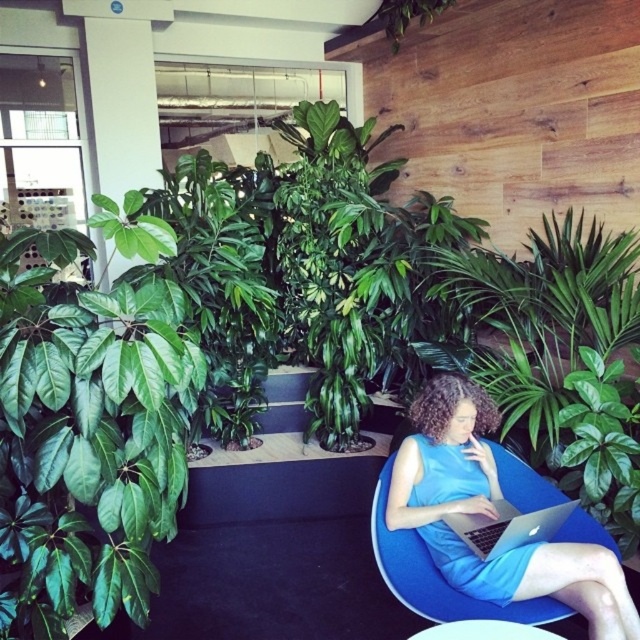
Question: Considering the real-world distances, which object is farthest from the blue fabric chair at lower right?

Choices:
 (A) green leafy plant at left
 (B) silver metallic laptop at center

Answer: (A)

Question: Which point is farther from the camera taking this photo?

Choices:
 (A) (3, 529)
 (B) (602, 586)
 (C) (563, 515)

Answer: (C)

Question: In this image, where is blue fabric chair at lower right located relative to silver metallic laptop at center?

Choices:
 (A) right
 (B) left

Answer: (B)

Question: Can you confirm if green leafy plant at left is positioned below blue fabric chair at lower right?

Choices:
 (A) no
 (B) yes

Answer: (A)

Question: Is green leafy plant at left to the left of blue fabric chair at lower right from the viewer's perspective?

Choices:
 (A) no
 (B) yes

Answer: (B)

Question: Which is farther from the blue fabric chair at lower right?

Choices:
 (A) silver metallic laptop at center
 (B) green leafy plant at left

Answer: (B)